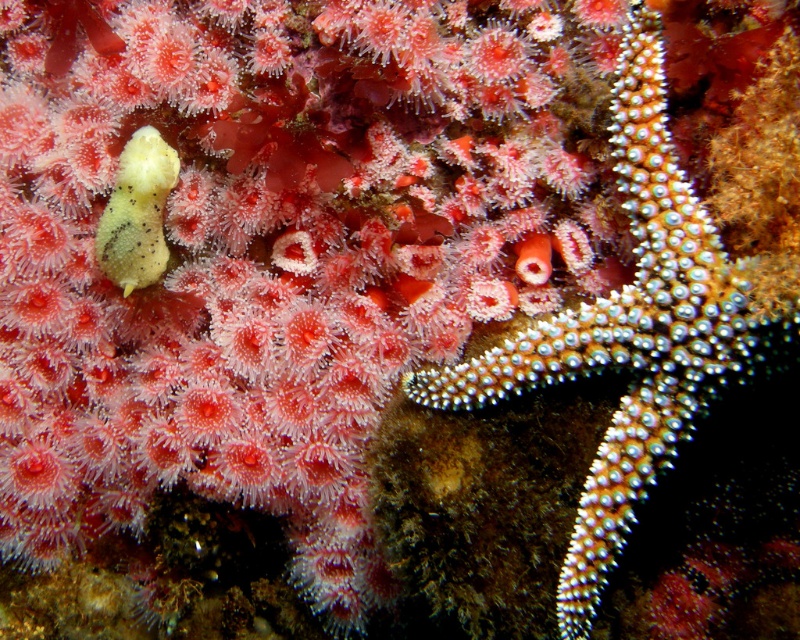
You are a marine biologist observing this underwater scene. You need to determine if the white spiny starfish at center can fit into a collection jar that can only accommodate objects narrower than the matte yellow sponge at left. Can it fit?

The white spiny starfish at center might be wider than the matte yellow sponge at left, so it may not fit into the jar if the sponge is the width limit.